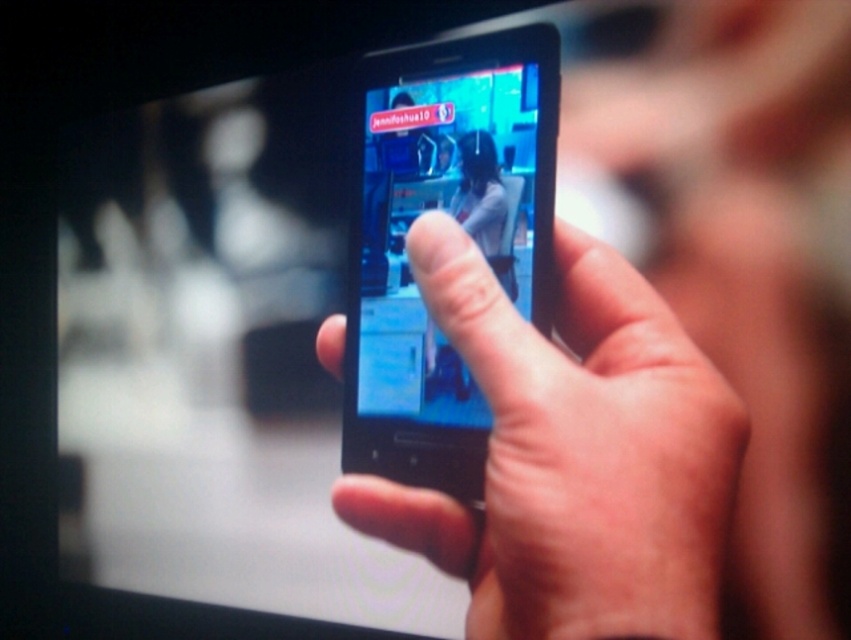
You are using a smartphone to video call your friend. On the screen, there are two points marked as point1 and point2. The coordinates of point1 are at (493,356) and point2 are at (398,193). Based on the image, which point is closer to the camera?

Point1 at (493,356) is closer to the camera than point2 at (398,193) because it is in front of point2.

You are a photographer trying to capture a clear image of the live video feed on the phone. Which phone, the matte black phone at center or the shiny blue phone at center, would be easier to photograph due to its nonreflective surface?

The matte black phone at center is easier to photograph because it has a nonreflective surface compared to the shiny blue phone at center, reducing glare and reflections in the photo.